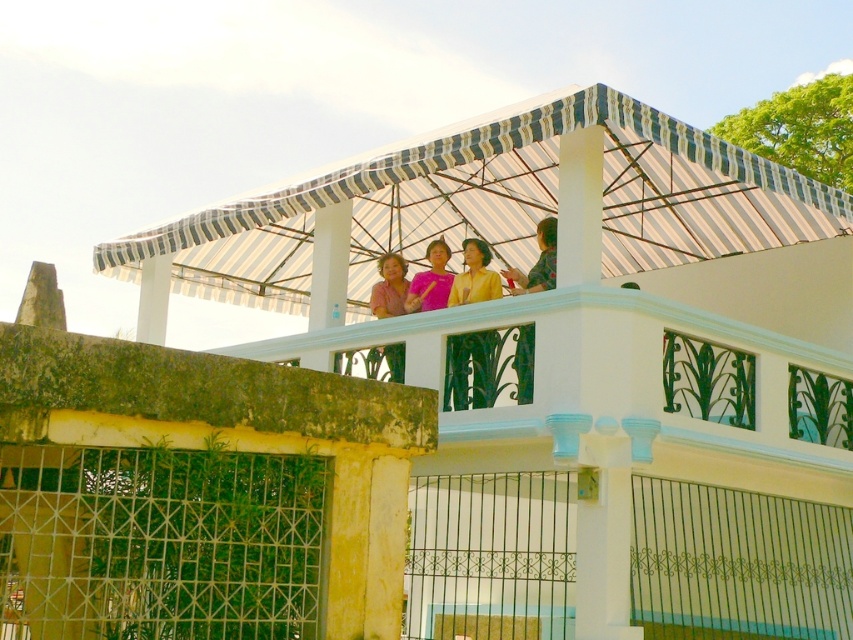
You are standing on the balcony and want to throw a ball to a friend who is standing at the point labeled as point (422, 340). If your throwing range is 30 feet, will you be able to reach them?

The distance between you and point (422, 340) is 40.26 feet, which exceeds your throwing range of 30 feet. You will not be able to reach them.

You are a painter standing on the balcony holding a ladder that is 3 meters long. You want to paint the white striped awning at center and the yellow matte blouse at center. Can you reach both objects with your ladder without moving it?

The white striped awning at center and yellow matte blouse at center are 3.80 meters apart from each other. Since the ladder is only 3 meters long, it cannot span the distance between them. Therefore, you cannot reach both objects with the ladder without moving it.

You are standing on the balcony and want to know which object is nearer to you. Which one is closer between the white striped awning at center and the white painted concrete balcony at upper center?

The white striped awning at center is closer to the viewer than the white painted concrete balcony at upper center.